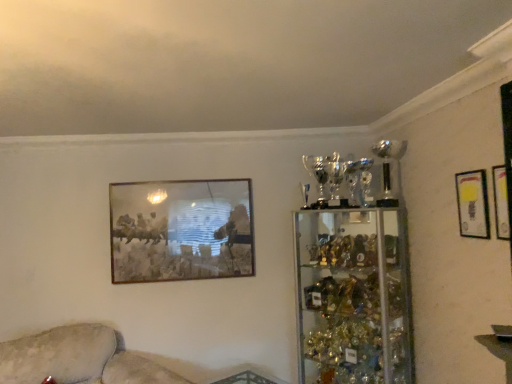
Measure the distance between beige fabric couch at lower left and camera.

The depth of beige fabric couch at lower left is 7.52 feet.

In the scene shown: Measure the distance between point [207,253] and camera.

10.19 feet.

You are a GUI agent. You are given a task and a screenshot of the screen. Output one action in this format:
    pyautogui.click(x=<x>, y=<y>)
    Task: Click on the matte gold picture frame at upper right, the 3th picture frame when ordered from left to right
    The height and width of the screenshot is (384, 512).
    Given the screenshot: What is the action you would take?
    pyautogui.click(x=501, y=202)

Based on their sizes in the image, would you say beige fabric couch at lower left is bigger or smaller than matte gold picture frame at upper right, the second picture frame viewed from the right?

beige fabric couch at lower left is bigger than matte gold picture frame at upper right, the second picture frame viewed from the right.

Can we say beige fabric couch at lower left lies outside matte gold picture frame at upper right, marked as the 2th picture frame in a left-to-right arrangement?

beige fabric couch at lower left is positioned outside matte gold picture frame at upper right, marked as the 2th picture frame in a left-to-right arrangement.

Image resolution: width=512 pixels, height=384 pixels. In order to click on the 2nd picture frame directly above the beige fabric couch at lower left (from a real-world perspective) in this screenshot , I will do `click(472, 204)`.

Which is closer, (17,371) or (485,210)?

Positioned in front is point (485,210).

In the scene shown: Measure the distance from beige fabric couch at lower left to metallic gold picture frame at upper center, placed as the first picture frame when sorted from left to right.

beige fabric couch at lower left and metallic gold picture frame at upper center, placed as the first picture frame when sorted from left to right, are 74.84 centimeters apart.

Considering the relative positions of beige fabric couch at lower left and metallic gold picture frame at upper center, the third picture frame in the front-to-back sequence, in the image provided, is beige fabric couch at lower left to the left or to the right of metallic gold picture frame at upper center, the third picture frame in the front-to-back sequence,?

beige fabric couch at lower left is to the left of metallic gold picture frame at upper center, the third picture frame in the front-to-back sequence.

Based on their sizes in the image, would you say beige fabric couch at lower left is bigger or smaller than metallic gold picture frame at upper center, the third picture frame in the front-to-back sequence?

Clearly, beige fabric couch at lower left is larger in size than metallic gold picture frame at upper center, the third picture frame in the front-to-back sequence.

Does beige fabric couch at lower left have a lesser height compared to metallic gold picture frame at upper center, which is the 1th picture frame in back-to-front order?

Yes.

Is metallic gold picture frame at upper center, the 3th picture frame from the right, directly adjacent to clear glass trophy case at right?

No, metallic gold picture frame at upper center, the 3th picture frame from the right, is not touching clear glass trophy case at right.

Looking at this image, could you measure the distance between metallic gold picture frame at upper center, the 3th picture frame from the right, and clear glass trophy case at right?

metallic gold picture frame at upper center, the 3th picture frame from the right, and clear glass trophy case at right are 82.20 centimeters apart.

Which object is wider, metallic gold picture frame at upper center, the third picture frame in the front-to-back sequence, or clear glass trophy case at right?

clear glass trophy case at right.

Is metallic gold picture frame at upper center, the 3th picture frame from the right, positioned with its back to clear glass trophy case at right?

No, clear glass trophy case at right is not at the back of metallic gold picture frame at upper center, the 3th picture frame from the right.

In order to click on picture frame that is the 1st object above the clear glass trophy case at right (from a real-world perspective) in this screenshot , I will do `click(181, 230)`.

Considering the sizes of clear glass trophy case at right and metallic gold picture frame at upper center, the third picture frame in the front-to-back sequence, in the image, is clear glass trophy case at right taller or shorter than metallic gold picture frame at upper center, the third picture frame in the front-to-back sequence,?

clear glass trophy case at right is taller than metallic gold picture frame at upper center, the third picture frame in the front-to-back sequence.

Considering the positions of objects clear glass trophy case at right and metallic gold picture frame at upper center, placed as the first picture frame when sorted from left to right, in the image provided, who is more to the left, clear glass trophy case at right or metallic gold picture frame at upper center, placed as the first picture frame when sorted from left to right,?

Positioned to the left is metallic gold picture frame at upper center, placed as the first picture frame when sorted from left to right.

Who is shorter, clear glass trophy case at right or matte gold picture frame at upper right, the second picture frame in the front-to-back sequence?

matte gold picture frame at upper right, the second picture frame in the front-to-back sequence, is shorter.

Would you consider clear glass trophy case at right to be distant from matte gold picture frame at upper right, the second picture frame in the front-to-back sequence?

That's not correct — clear glass trophy case at right is a little close to matte gold picture frame at upper right, the second picture frame in the front-to-back sequence.

Considering the points (309, 374) and (486, 187), which point is in front, point (309, 374) or point (486, 187)?

Point (486, 187)

Based on the photo, considering the sizes of objects clear glass trophy case at right and matte gold picture frame at upper right, which appears as the second picture frame when viewed from the back, in the image provided, who is bigger, clear glass trophy case at right or matte gold picture frame at upper right, which appears as the second picture frame when viewed from the back,?

With larger size is clear glass trophy case at right.

Which is correct: matte gold picture frame at upper right, placed as the 3th picture frame when sorted from back to front, is inside metallic gold picture frame at upper center, the 3th picture frame from the right, or outside of it?

matte gold picture frame at upper right, placed as the 3th picture frame when sorted from back to front, cannot be found inside metallic gold picture frame at upper center, the 3th picture frame from the right.

Is matte gold picture frame at upper right, marked as the 1th picture frame in a right-to-left arrangement, far from metallic gold picture frame at upper center, the third picture frame in the front-to-back sequence?

That's right, there is a large distance between matte gold picture frame at upper right, marked as the 1th picture frame in a right-to-left arrangement, and metallic gold picture frame at upper center, the third picture frame in the front-to-back sequence.

Which object is positioned more to the right, matte gold picture frame at upper right, which is the first picture frame from front to back, or metallic gold picture frame at upper center, placed as the first picture frame when sorted from left to right?

matte gold picture frame at upper right, which is the first picture frame from front to back.

From a real-world perspective, which picture frame is the 1st one above the metallic gold picture frame at upper center, the third picture frame in the front-to-back sequence? Please provide its 2D coordinates.

[(472, 204)]

In the scene shown: Would you say matte gold picture frame at upper right, the second picture frame in the front-to-back sequence, is inside or outside metallic gold picture frame at upper center, the third picture frame in the front-to-back sequence?

matte gold picture frame at upper right, the second picture frame in the front-to-back sequence, cannot be found inside metallic gold picture frame at upper center, the third picture frame in the front-to-back sequence.

Which point is more distant from viewer, (x=467, y=195) or (x=187, y=249)?

Point (x=187, y=249)

Who is taller, matte gold picture frame at upper right, the second picture frame viewed from the right, or metallic gold picture frame at upper center, the 3th picture frame from the right?

metallic gold picture frame at upper center, the 3th picture frame from the right, is taller.

In order to click on couch in front of the matte gold picture frame at upper right, the second picture frame in the front-to-back sequence in this screenshot , I will do `click(78, 359)`.

Where is `the 1st picture frame located above the beige fabric couch at lower left (from a real-world perspective)`? The width and height of the screenshot is (512, 384). the 1st picture frame located above the beige fabric couch at lower left (from a real-world perspective) is located at coordinates (181, 230).

From the image, which object appears to be nearer to matte gold picture frame at upper right, which appears as the second picture frame when viewed from the back, beige fabric couch at lower left or clear glass trophy case at right?

The object closer to matte gold picture frame at upper right, which appears as the second picture frame when viewed from the back, is clear glass trophy case at right.

When comparing their distances from matte gold picture frame at upper right, which appears as the second picture frame when viewed from the back, does clear glass trophy case at right or matte gold picture frame at upper right, placed as the 3th picture frame when sorted from back to front, seem closer?

matte gold picture frame at upper right, placed as the 3th picture frame when sorted from back to front.

Consider the image. From the image, which object appears to be nearer to metallic gold picture frame at upper center, the 3th picture frame from the right, matte gold picture frame at upper right, placed as the 3th picture frame when sorted from back to front, or beige fabric couch at lower left?

Among the two, beige fabric couch at lower left is located nearer to metallic gold picture frame at upper center, the 3th picture frame from the right.

Estimate the real-world distances between objects in this image. Which object is closer to metallic gold picture frame at upper center, which is the 1th picture frame in back-to-front order, matte gold picture frame at upper right, the second picture frame in the front-to-back sequence, or matte gold picture frame at upper right, placed as the 3th picture frame when sorted from back to front?

matte gold picture frame at upper right, the second picture frame in the front-to-back sequence, is positioned closer to the anchor metallic gold picture frame at upper center, which is the 1th picture frame in back-to-front order.

Based on the photo, from the image, which object appears to be farther from metallic gold picture frame at upper center, the third picture frame in the front-to-back sequence, matte gold picture frame at upper right, marked as the 2th picture frame in a left-to-right arrangement, or beige fabric couch at lower left?

The object further to metallic gold picture frame at upper center, the third picture frame in the front-to-back sequence, is matte gold picture frame at upper right, marked as the 2th picture frame in a left-to-right arrangement.

Considering their positions, is beige fabric couch at lower left positioned further to metallic gold picture frame at upper center, which is the 1th picture frame in back-to-front order, than matte gold picture frame at upper right, the 3th picture frame when ordered from left to right?

Among the two, matte gold picture frame at upper right, the 3th picture frame when ordered from left to right, is located further to metallic gold picture frame at upper center, which is the 1th picture frame in back-to-front order.

Based on their spatial positions, is beige fabric couch at lower left or metallic gold picture frame at upper center, which is the 1th picture frame in back-to-front order, further from matte gold picture frame at upper right, the second picture frame in the front-to-back sequence?

beige fabric couch at lower left is further to matte gold picture frame at upper right, the second picture frame in the front-to-back sequence.

From the image, which object appears to be nearer to metallic gold picture frame at upper center, placed as the first picture frame when sorted from left to right, clear glass trophy case at right or matte gold picture frame at upper right, marked as the 1th picture frame in a right-to-left arrangement?

clear glass trophy case at right is positioned closer to the anchor metallic gold picture frame at upper center, placed as the first picture frame when sorted from left to right.

The width and height of the screenshot is (512, 384). Identify the location of picture frame between beige fabric couch at lower left and clear glass trophy case at right from left to right. (181, 230).

Where is `shelf between metallic gold picture frame at upper center, the third picture frame in the front-to-back sequence, and matte gold picture frame at upper right, which appears as the second picture frame when viewed from the back, from left to right`? shelf between metallic gold picture frame at upper center, the third picture frame in the front-to-back sequence, and matte gold picture frame at upper right, which appears as the second picture frame when viewed from the back, from left to right is located at coordinates (353, 297).

Where is `shelf situated between beige fabric couch at lower left and matte gold picture frame at upper right, the second picture frame in the front-to-back sequence, from left to right`? The width and height of the screenshot is (512, 384). shelf situated between beige fabric couch at lower left and matte gold picture frame at upper right, the second picture frame in the front-to-back sequence, from left to right is located at coordinates (353, 297).

At what (x,y) coordinates should I click in order to perform the action: click on shelf situated between beige fabric couch at lower left and matte gold picture frame at upper right, placed as the 3th picture frame when sorted from back to front, from left to right. Please return your answer as a coordinate pair (x, y). Looking at the image, I should click on (353, 297).